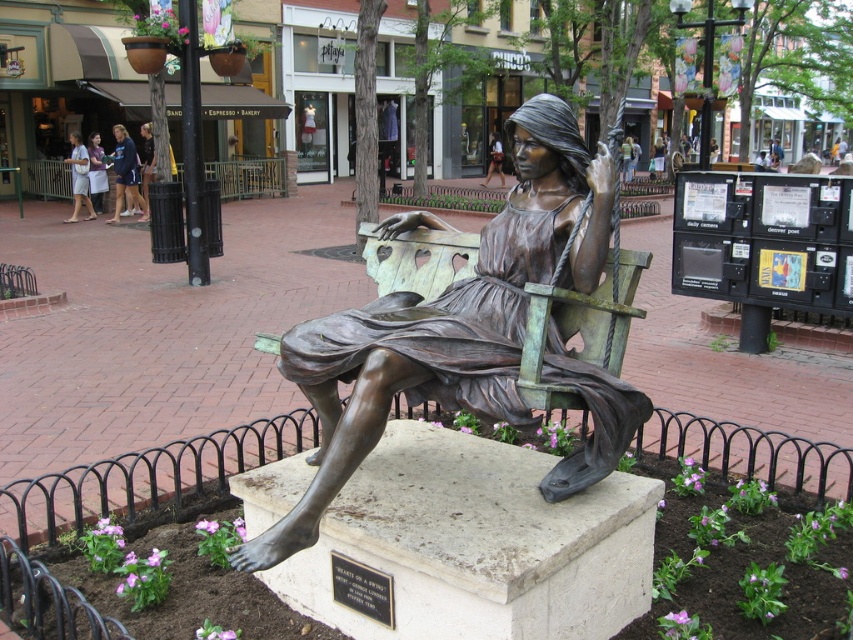
Does point (122, 170) lie in front of point (85, 147)?

Yes, it is in front of point (85, 147).

Is blue athletic wear at left bigger than white cotton shorts at left?

Incorrect, blue athletic wear at left is not larger than white cotton shorts at left.

Find the location of a particular element. blue athletic wear at left is located at coordinates (125, 172).

This screenshot has width=853, height=640. In order to click on blue athletic wear at left in this screenshot , I will do `click(125, 172)`.

Consider the image. Who is higher up, bronze statue at center or white cotton shorts at left?

white cotton shorts at left

Between point (553, 230) and point (74, 220), which one is positioned in front?

Positioned in front is point (553, 230).

Who is more distant from viewer, (526, 216) or (73, 140)?

Positioned behind is point (73, 140).

Find the location of a particular element. The image size is (853, 640). bronze statue at center is located at coordinates (450, 320).

Does bronze statue at center have a lesser width compared to light brown leather jacket at upper center?

No.

Locate an element on the screen. bronze statue at center is located at coordinates (450, 320).

You are a GUI agent. You are given a task and a screenshot of the screen. Output one action in this format:
    pyautogui.click(x=<x>, y=<y>)
    Task: Click on the bronze statue at center
    The width and height of the screenshot is (853, 640).
    Given the screenshot: What is the action you would take?
    [450, 320]